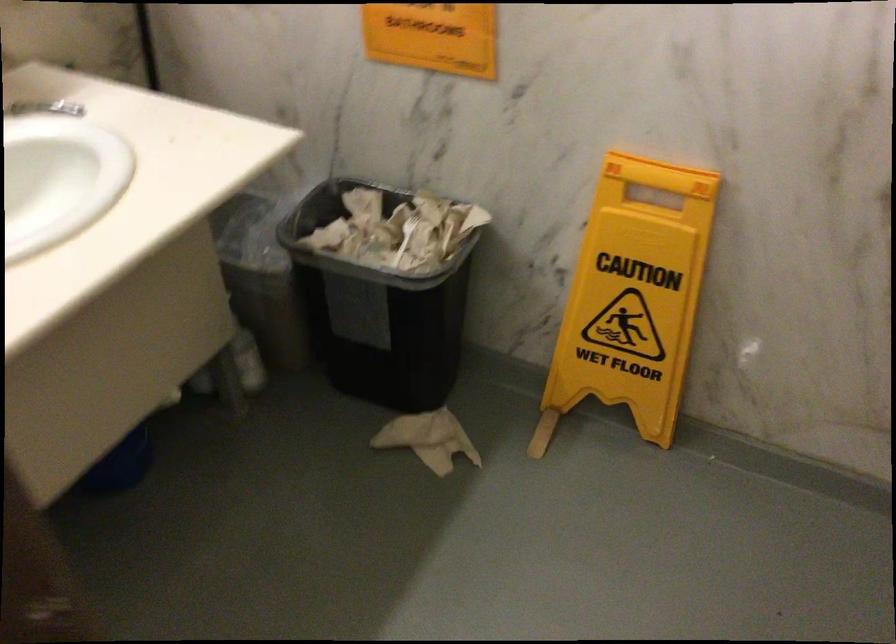
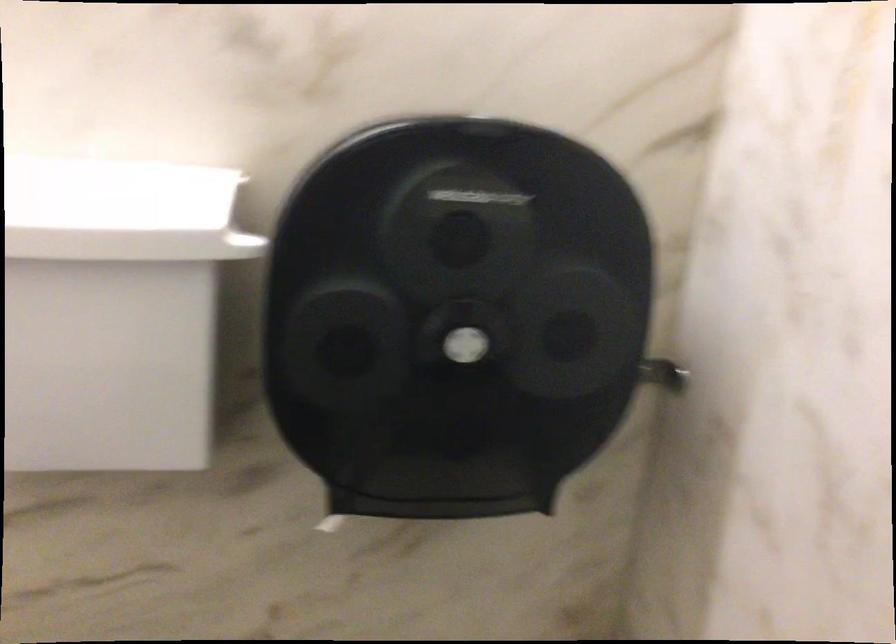
Question: The camera is either moving clockwise (left) or counter-clockwise (right) around the object. The first image is from the beginning of the video and the second image is from the end. Is the camera moving left or right when shooting the video?

Choices:
 (A) Left
 (B) Right

Answer: (B)